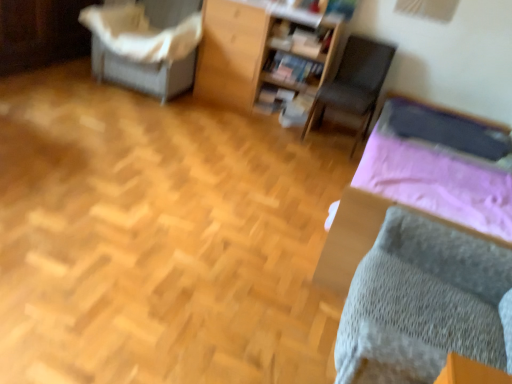
The height and width of the screenshot is (384, 512). In order to click on vacant area situated below dark gray fabric chair at center (from a real-world perspective) in this screenshot , I will do `click(329, 134)`.